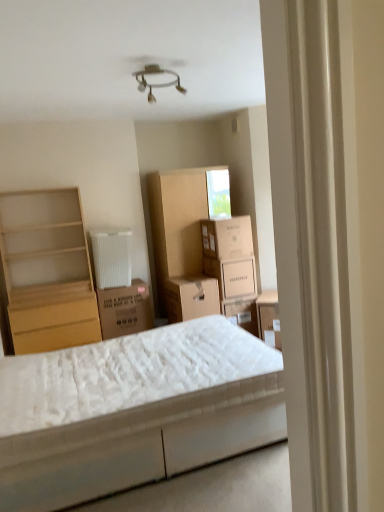
Question: From the image's perspective, would you say white cardboard box at center, placed as the first cardboard box when sorted from top to bottom, is positioned over brown cardboard box at center, marked as the first cardboard box in a left-to-right arrangement?

Choices:
 (A) no
 (B) yes

Answer: (B)

Question: Could brown cardboard box at center, marked as the first cardboard box in a left-to-right arrangement, be considered to be inside white cardboard box at center, the 2th cardboard box viewed from the left?

Choices:
 (A) no
 (B) yes

Answer: (A)

Question: Can you confirm if white cardboard box at center, which is the 2th cardboard box from right to left, is positioned to the right of brown cardboard box at center, the third cardboard box viewed from the top?

Choices:
 (A) no
 (B) yes

Answer: (B)

Question: Considering the relative positions of white cardboard box at center, placed as the first cardboard box when sorted from top to bottom, and brown cardboard box at center, the third cardboard box viewed from the top, in the image provided, is white cardboard box at center, placed as the first cardboard box when sorted from top to bottom, to the left of brown cardboard box at center, the third cardboard box viewed from the top, from the viewer's perspective?

Choices:
 (A) no
 (B) yes

Answer: (A)

Question: Does white cardboard box at center, arranged as the 3th cardboard box when ordered from the bottom, have a smaller size compared to brown cardboard box at center, marked as the first cardboard box in a left-to-right arrangement?

Choices:
 (A) no
 (B) yes

Answer: (B)

Question: From a real-world perspective, is white cardboard box at center, the 2th cardboard box viewed from the left, beneath brown cardboard box at center, the 1th cardboard box when ordered from bottom to top?

Choices:
 (A) no
 (B) yes

Answer: (A)

Question: From the image's perspective, is white cardboard box at center, acting as the 3th cardboard box starting from the left, below matte cardboard storage box at center, which is the first storage box from right to left?

Choices:
 (A) yes
 (B) no

Answer: (B)

Question: Considering the relative sizes of white cardboard box at center, marked as the 2th cardboard box in a top-to-bottom arrangement, and matte cardboard storage box at center, which ranks as the 2th storage box in left-to-right order, in the image provided, is white cardboard box at center, marked as the 2th cardboard box in a top-to-bottom arrangement, bigger than matte cardboard storage box at center, which ranks as the 2th storage box in left-to-right order,?

Choices:
 (A) yes
 (B) no

Answer: (B)

Question: Could you tell me if white cardboard box at center, positioned as the second cardboard box in bottom-to-top order, is facing matte cardboard storage box at center, which is the first storage box from right to left?

Choices:
 (A) yes
 (B) no

Answer: (B)

Question: Is white cardboard box at center, acting as the 3th cardboard box starting from the left, positioned behind matte cardboard storage box at center, which ranks as the 2th storage box in left-to-right order?

Choices:
 (A) yes
 (B) no

Answer: (A)

Question: Is white cardboard box at center, acting as the 3th cardboard box starting from the left, at the right side of matte cardboard storage box at center, which is the first storage box from right to left?

Choices:
 (A) yes
 (B) no

Answer: (B)

Question: From a real-world perspective, is white cardboard box at center, acting as the 3th cardboard box starting from the left, positioned under matte cardboard storage box at center, which is the first storage box from right to left, based on gravity?

Choices:
 (A) no
 (B) yes

Answer: (A)

Question: From the image's perspective, is light wood shelf at left on white quilted mattress at center?

Choices:
 (A) yes
 (B) no

Answer: (A)